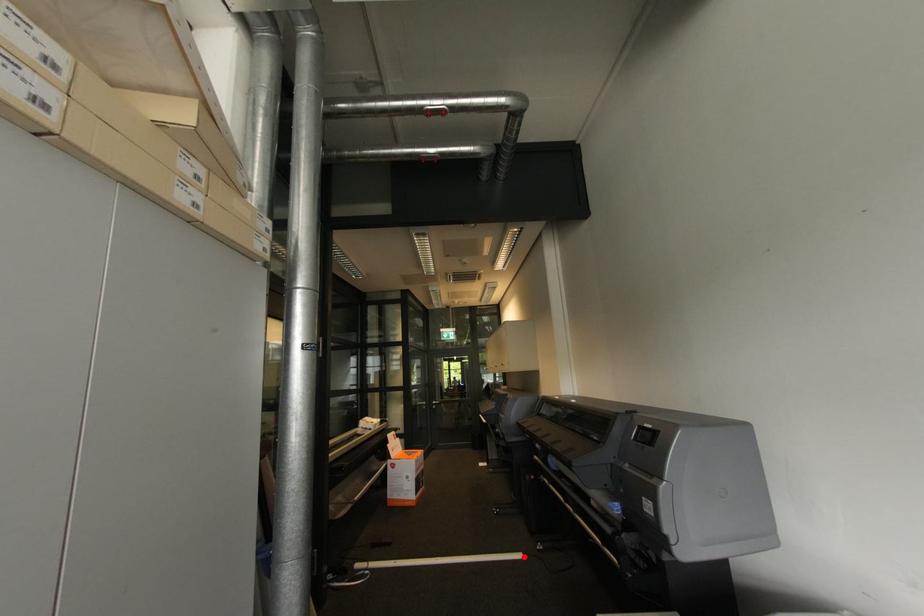
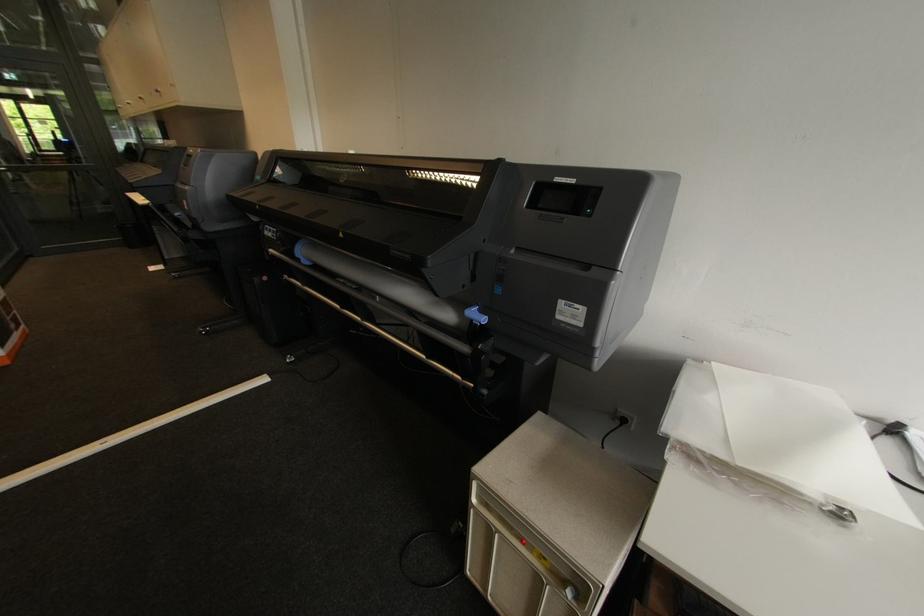
Question: I am providing you with two images of the same scene from different viewpoints. Image1 has a red point marked. In image2, the corresponding 3D location appears at what relative position? Reply with the corresponding letter.

Choices:
 (A) Closer
 (B) Farther

Answer: (B)